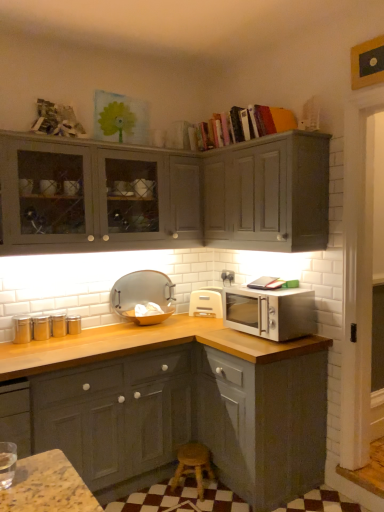
Question: Is the depth of wooden at lower center greater than that of satin silver microwave at right?

Choices:
 (A) yes
 (B) no

Answer: (A)

Question: From the image's perspective, is wooden at lower center on top of satin silver microwave at right?

Choices:
 (A) no
 (B) yes

Answer: (A)

Question: Is wooden at lower center closer to the viewer compared to satin silver microwave at right?

Choices:
 (A) no
 (B) yes

Answer: (A)

Question: Can you confirm if wooden at lower center is bigger than satin silver microwave at right?

Choices:
 (A) no
 (B) yes

Answer: (A)

Question: Considering the relative sizes of wooden at lower center and satin silver microwave at right in the image provided, is wooden at lower center shorter than satin silver microwave at right?

Choices:
 (A) yes
 (B) no

Answer: (A)

Question: Does point (201, 495) appear closer or farther from the camera than point (216, 142)?

Choices:
 (A) farther
 (B) closer

Answer: (B)

Question: Is wooden at lower center taller or shorter than hardcover books at upper center?

Choices:
 (A) tall
 (B) short

Answer: (B)

Question: From a real-world perspective, is wooden at lower center physically located above or below hardcover books at upper center?

Choices:
 (A) below
 (B) above

Answer: (A)

Question: From the image's perspective, is wooden at lower center above or below hardcover books at upper center?

Choices:
 (A) above
 (B) below

Answer: (B)

Question: Considering the positions of matte gray cabinets at upper left, arranged as the second cabinetry when viewed from the top, and wooden at lower center in the image, is matte gray cabinets at upper left, arranged as the second cabinetry when viewed from the top, taller or shorter than wooden at lower center?

Choices:
 (A) tall
 (B) short

Answer: (A)

Question: From a real-world perspective, is matte gray cabinets at upper left, the second cabinetry positioned from the bottom, above or below wooden at lower center?

Choices:
 (A) below
 (B) above

Answer: (B)

Question: Is matte gray cabinets at upper left, arranged as the second cabinetry when viewed from the top, bigger or smaller than wooden at lower center?

Choices:
 (A) small
 (B) big

Answer: (B)

Question: In the image, is matte gray cabinets at upper left, the second cabinetry positioned from the bottom, positioned in front of or behind wooden at lower center?

Choices:
 (A) front
 (B) behind

Answer: (A)

Question: Is matte silver tray at center, marked as the second appliance in a right-to-left arrangement, inside the boundaries of wooden at lower center, or outside?

Choices:
 (A) outside
 (B) inside

Answer: (A)

Question: Is matte silver tray at center, the 1th appliance when ordered from left to right, taller or shorter than wooden at lower center?

Choices:
 (A) short
 (B) tall

Answer: (B)